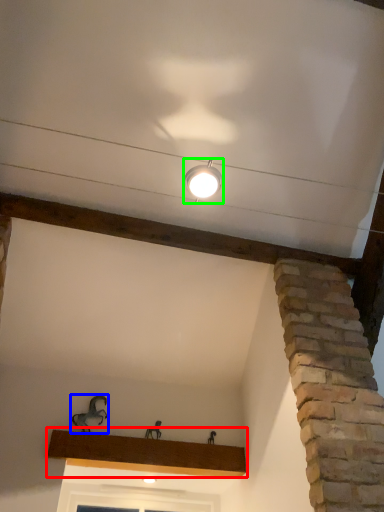
Question: Which object is the farthest from window sill (highlighted by a red box)? Choose among these: animal (highlighted by a blue box) or lamp (highlighted by a green box).

Choices:
 (A) animal
 (B) lamp

Answer: (B)